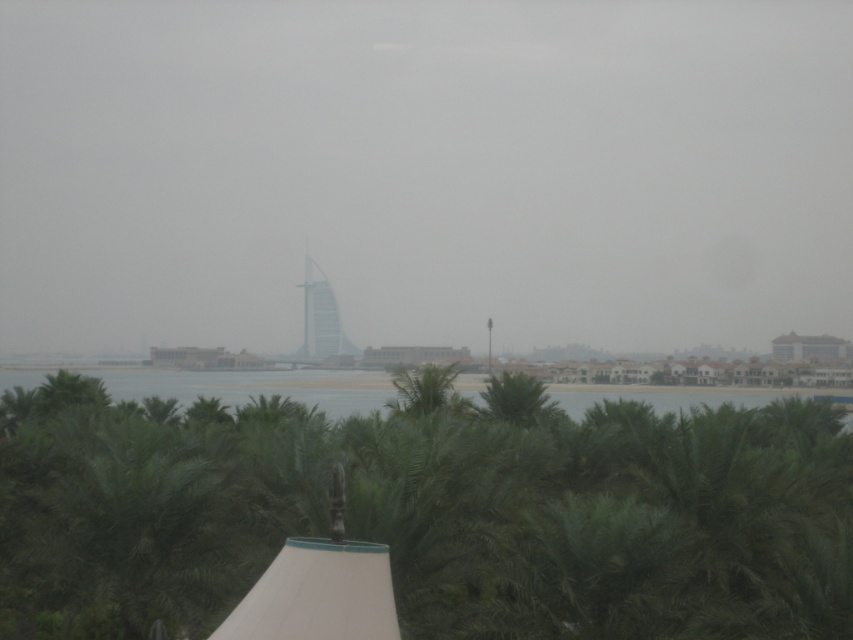
Question: Considering the real-world distances, which object is farthest from the transparent glass skyscraper at center?

Choices:
 (A) green leafy water at center
 (B) green leafy tree at center
 (C) glassy white sail at center

Answer: (B)

Question: Does transparent glass skyscraper at center appear on the right side of green leafy water at center?

Choices:
 (A) no
 (B) yes

Answer: (A)

Question: Does transparent glass skyscraper at center come in front of green leafy tree at center?

Choices:
 (A) yes
 (B) no

Answer: (B)

Question: Which is farther from the glassy white sail at center?

Choices:
 (A) transparent glass skyscraper at center
 (B) green leafy tree at center
 (C) green leafy water at center

Answer: (B)

Question: Considering the relative positions of transparent glass skyscraper at center and glassy white sail at center in the image provided, where is transparent glass skyscraper at center located with respect to glassy white sail at center?

Choices:
 (A) above
 (B) below

Answer: (A)

Question: Estimate the real-world distances between objects in this image. Which object is farther from the glassy white sail at center?

Choices:
 (A) transparent glass skyscraper at center
 (B) green leafy tree at center

Answer: (B)